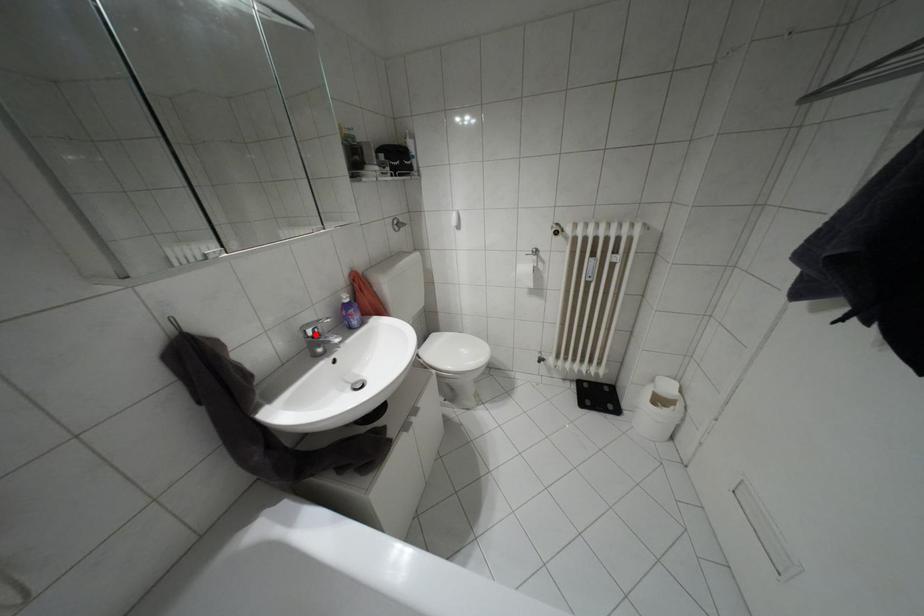
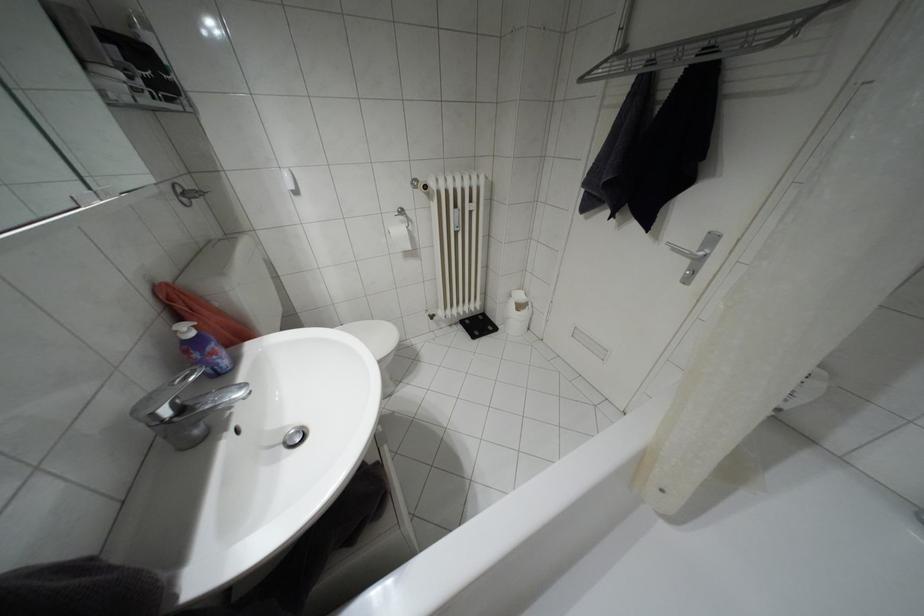
Locate, in the second image, the point that corresponds to the highlighted location in the first image.

(180, 408)